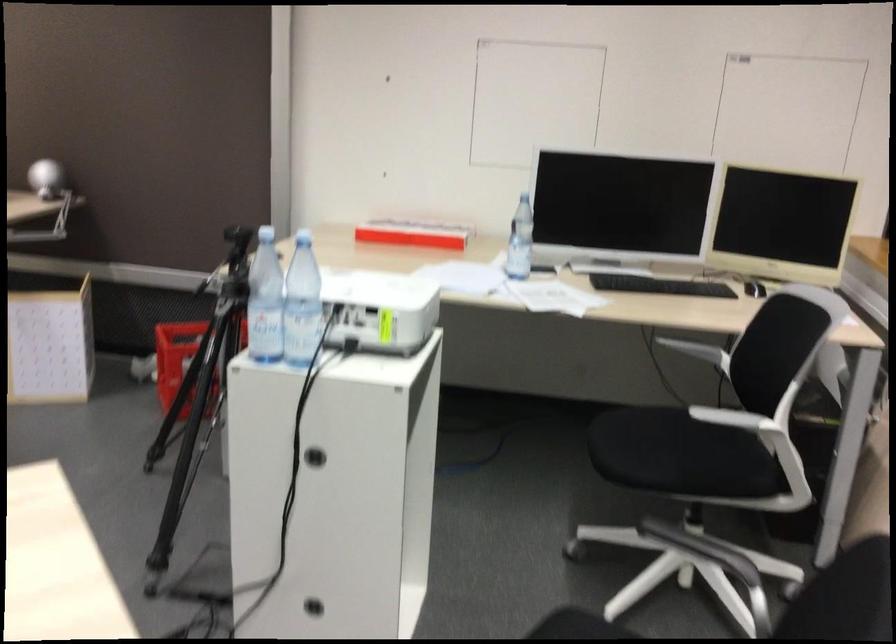
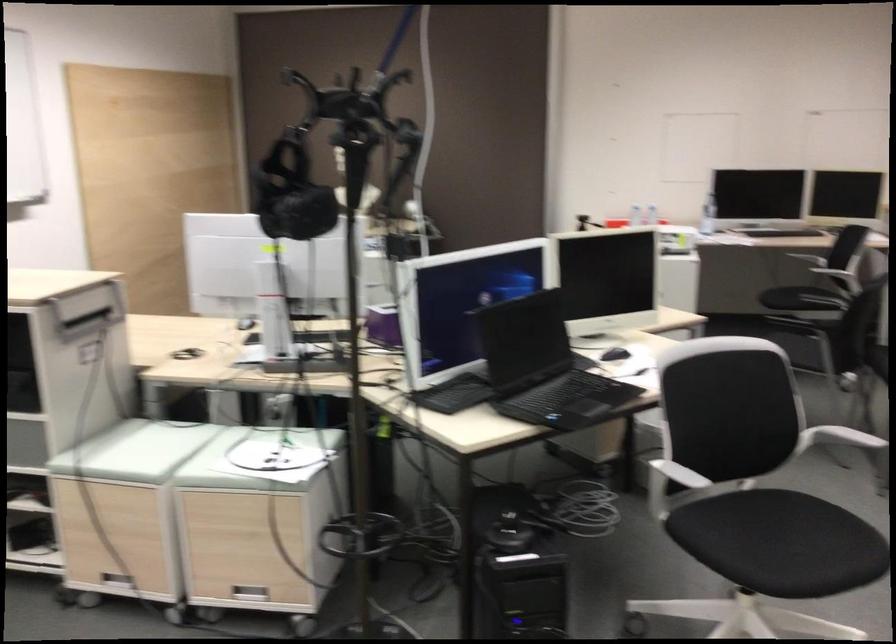
Question: I am providing you with two images of the same scene from different viewpoints. Please identify which objects are invisible in image2.

Choices:
 (A) black VR headset
 (B) white projector
 (C) black chair sitting surface
 (D) metal ladder step

Answer: (B)